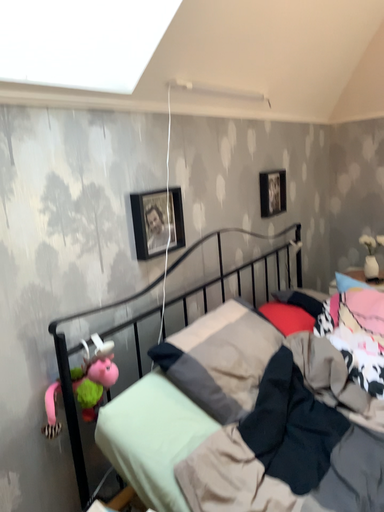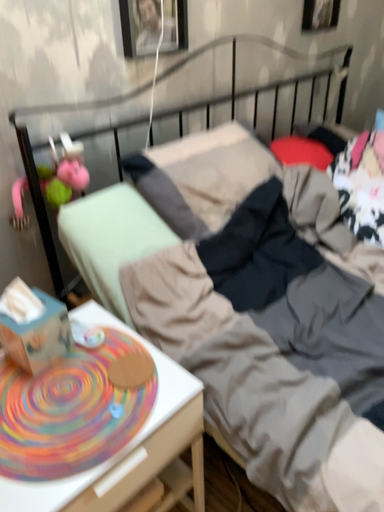
Question: How did the camera likely rotate when shooting the video?

Choices:
 (A) rotated right
 (B) rotated left

Answer: (B)